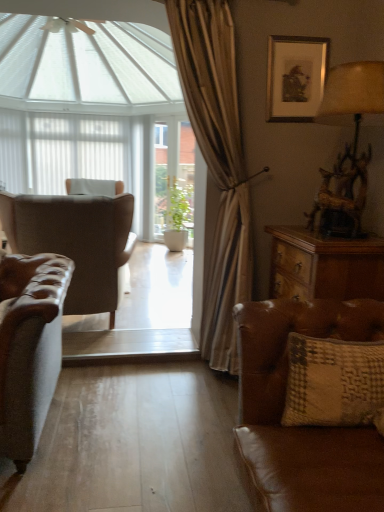
Question: Does white sheer curtain at upper center have a smaller size compared to white matte shutter at left?

Choices:
 (A) no
 (B) yes

Answer: (A)

Question: Is white sheer curtain at upper center wider than white matte shutter at left?

Choices:
 (A) yes
 (B) no

Answer: (A)

Question: Is white sheer curtain at upper center facing towards white matte shutter at left?

Choices:
 (A) yes
 (B) no

Answer: (B)

Question: Is white sheer curtain at upper center placed right next to white matte shutter at left?

Choices:
 (A) no
 (B) yes

Answer: (A)

Question: Considering the relative sizes of white sheer curtain at upper center and white matte shutter at left in the image provided, is white sheer curtain at upper center thinner than white matte shutter at left?

Choices:
 (A) yes
 (B) no

Answer: (B)

Question: Is textured beige pillow at lower right spatially inside silver metallic picture frame at upper right, or outside of it?

Choices:
 (A) inside
 (B) outside

Answer: (B)

Question: In terms of width, does textured beige pillow at lower right look wider or thinner when compared to silver metallic picture frame at upper right?

Choices:
 (A) wide
 (B) thin

Answer: (A)

Question: Is textured beige pillow at lower right bigger or smaller than silver metallic picture frame at upper right?

Choices:
 (A) small
 (B) big

Answer: (B)

Question: Is textured beige pillow at lower right in front of or behind silver metallic picture frame at upper right in the image?

Choices:
 (A) front
 (B) behind

Answer: (A)

Question: From a real-world perspective, is brown leather couch at lower right positioned above or below leather wingback chair at left?

Choices:
 (A) below
 (B) above

Answer: (A)

Question: Visually, is brown leather couch at lower right positioned to the left or to the right of leather wingback chair at left?

Choices:
 (A) left
 (B) right

Answer: (B)

Question: Is brown leather couch at lower right bigger or smaller than leather wingback chair at left?

Choices:
 (A) big
 (B) small

Answer: (B)

Question: Considering the positions of brown leather couch at lower right and leather wingback chair at left in the image, is brown leather couch at lower right taller or shorter than leather wingback chair at left?

Choices:
 (A) short
 (B) tall

Answer: (A)

Question: Based on their sizes in the image, would you say textured beige pillow at lower right is bigger or smaller than white sheer curtain at upper center?

Choices:
 (A) big
 (B) small

Answer: (B)

Question: In terms of width, does textured beige pillow at lower right look wider or thinner when compared to white sheer curtain at upper center?

Choices:
 (A) wide
 (B) thin

Answer: (A)